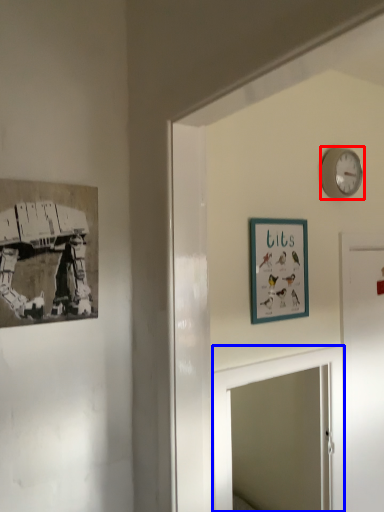
Question: Among these objects, which one is nearest to the camera, wall clock (highlighted by a red box) or mirror (highlighted by a blue box)?

Choices:
 (A) wall clock
 (B) mirror

Answer: (B)